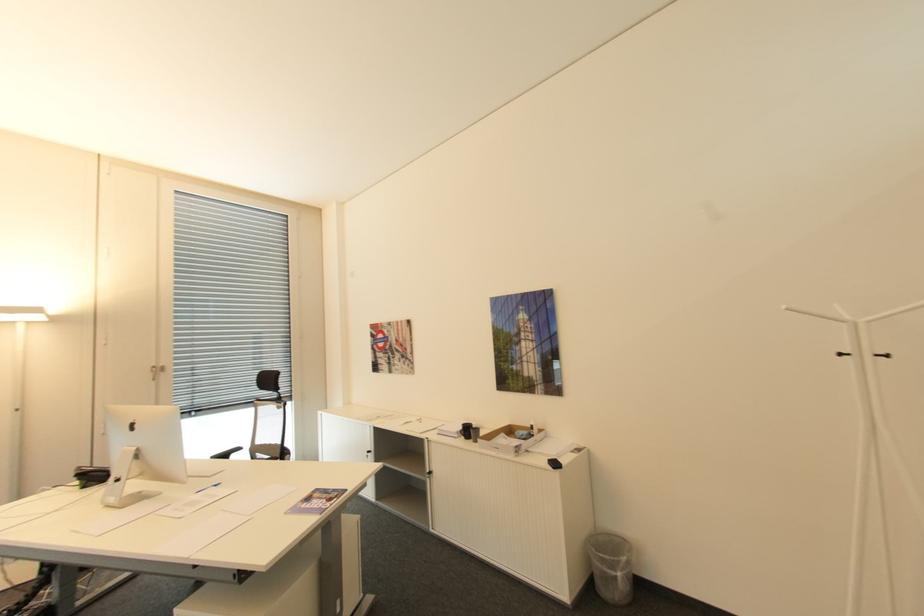
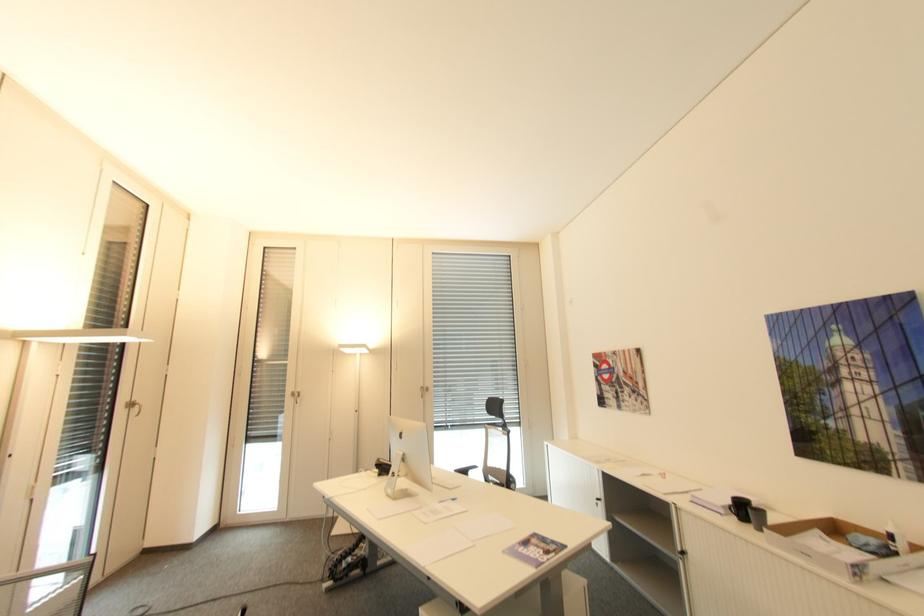
Where in the second image is the point corresponding to [159,367] from the first image?

(427, 387)